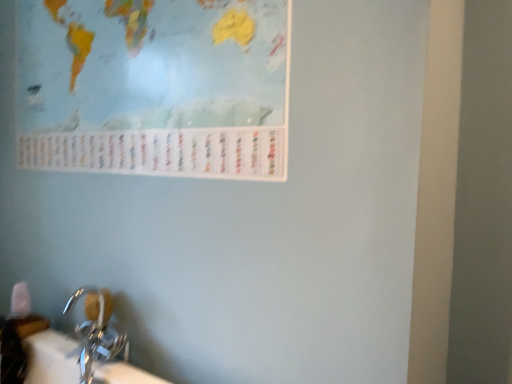
This screenshot has width=512, height=384. Describe the element at coordinates (154, 87) in the screenshot. I see `matte paper map at upper left` at that location.

This screenshot has width=512, height=384. I want to click on matte paper map at upper left, so click(x=154, y=87).

Image resolution: width=512 pixels, height=384 pixels. I want to click on matte paper map at upper left, so click(x=154, y=87).